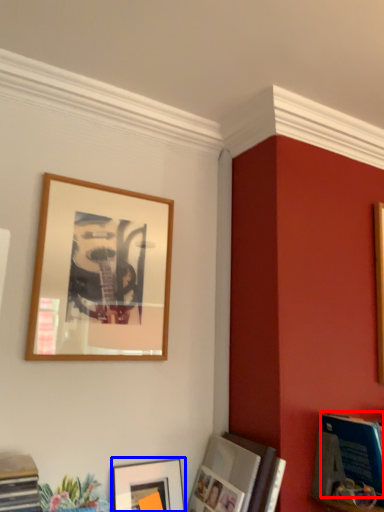
Question: Which object is further to the camera taking this photo, magazine (highlighted by a red box) or picture frame (highlighted by a blue box)?

Choices:
 (A) magazine
 (B) picture frame

Answer: (B)